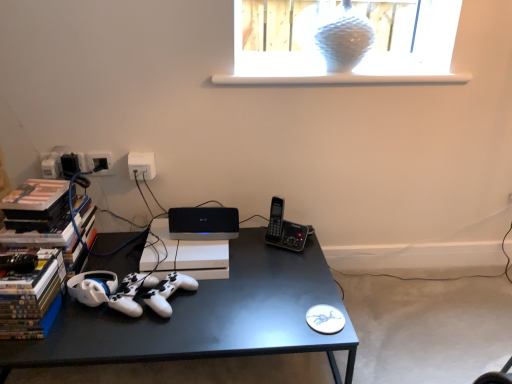
Locate an element on the screen. The height and width of the screenshot is (384, 512). free space in front of black plastic phone at right is located at coordinates (277, 271).